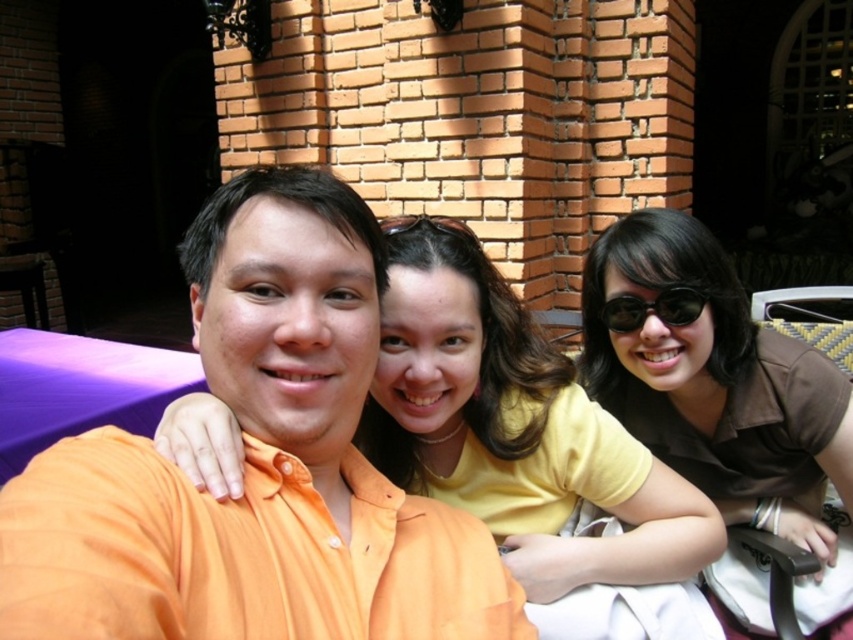
Question: Which of the following is the closest to the observer?

Choices:
 (A) (699, 480)
 (B) (578, 396)

Answer: (B)

Question: Can you confirm if orange cotton shirt at center is positioned above sunglasses at center?

Choices:
 (A) yes
 (B) no

Answer: (B)

Question: Is orange cotton shirt at center positioned before brown matte shirt at center?

Choices:
 (A) no
 (B) yes

Answer: (B)

Question: Considering the real-world distances, which object is closest to the brown matte shirt at center?

Choices:
 (A) purple fabric table at lower left
 (B) sunglasses at center
 (C) yellow matte shirt at center

Answer: (B)

Question: Estimate the real-world distances between objects in this image. Which object is farther from the orange cotton shirt at center?

Choices:
 (A) brown matte shirt at center
 (B) yellow matte shirt at center

Answer: (A)

Question: Is orange cotton shirt at center to the right of sunglasses at center from the viewer's perspective?

Choices:
 (A) yes
 (B) no

Answer: (B)